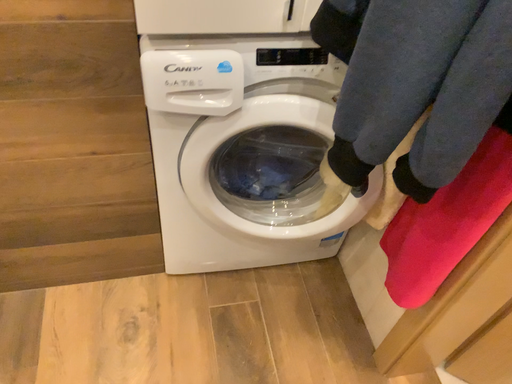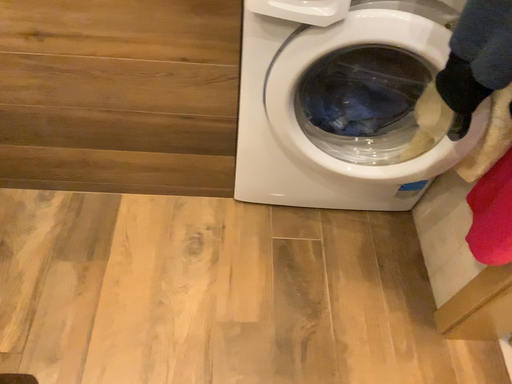
Question: How did the camera likely rotate when shooting the video?

Choices:
 (A) rotated left
 (B) rotated right

Answer: (A)